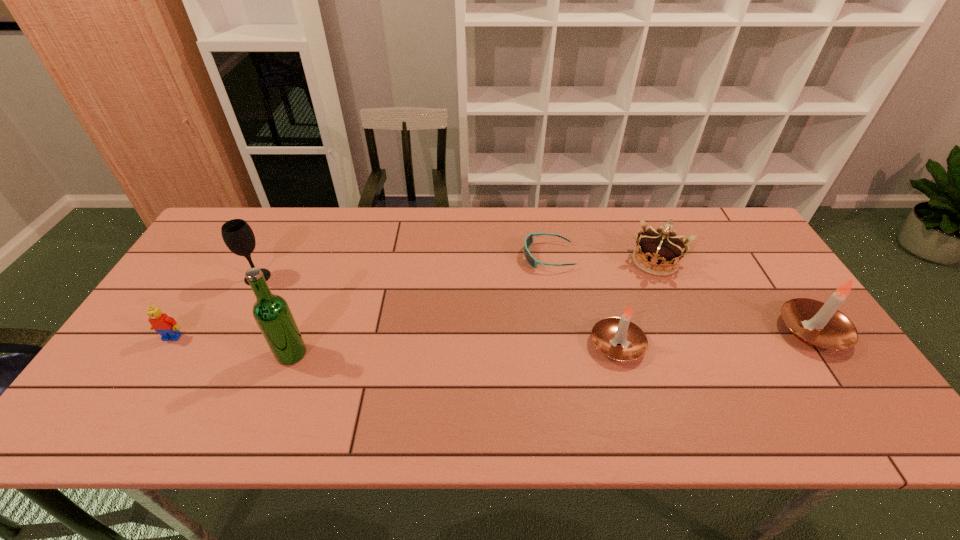
At what (x,y) coordinates should I click in order to perform the action: click on crown located in the far edge section of the desktop. Please return your answer as a coordinate pair (x, y). The image size is (960, 540). Looking at the image, I should click on (657, 250).

Find the location of `candle at the near edge`. candle at the near edge is located at coordinates (618, 338).

The width and height of the screenshot is (960, 540). In order to click on beer bottle positioned at the near edge in this screenshot , I will do `click(271, 312)`.

Identify the location of object that is at the left edge. The height and width of the screenshot is (540, 960). (167, 327).

Image resolution: width=960 pixels, height=540 pixels. I want to click on object that is at the right edge, so click(821, 325).

The height and width of the screenshot is (540, 960). Find the location of `vacant space at the far edge of the desktop`. vacant space at the far edge of the desktop is located at coordinates (585, 218).

This screenshot has height=540, width=960. I want to click on vacant position at the near edge of the desktop, so click(707, 387).

In the image, there is a desktop. Identify the location of vacant space at the left edge. (209, 280).

I want to click on free space at the near left corner of the desktop, so click(127, 379).

Where is `free spot between the shortest object and the fourth tallest object`? Image resolution: width=960 pixels, height=540 pixels. free spot between the shortest object and the fourth tallest object is located at coordinates (583, 301).